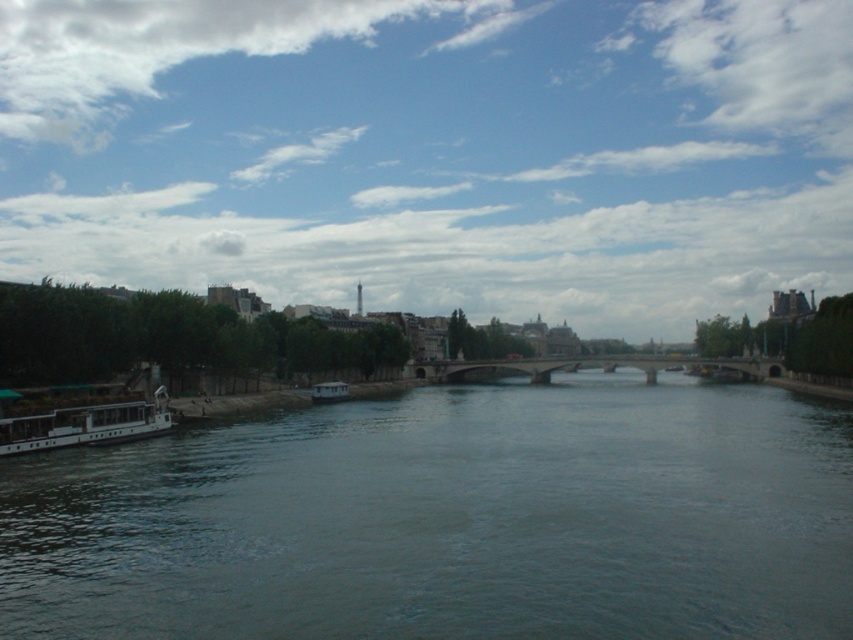
You are a photographer positioned on the riverside. You want to capture both the white glossy boat at lower left and the white matte boat at center in your shot. Which boat will appear larger in the photo?

The white glossy boat at lower left will appear larger in the photo because it is closer to the viewer than the white matte boat at center.

What are the coordinates of the blue sky at upper center in the image?

The coordinates of the blue sky at upper center are at point (434, 150).

Based on the scene, what is located at the coordinates point (86, 426)?

The white glossy boat at lower left is located at point (86, 426).